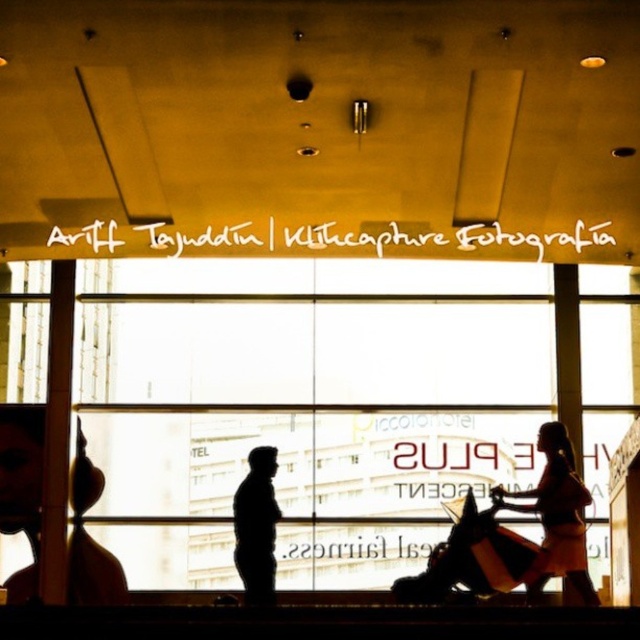
Who is positioned more to the right, matte black baby carriage at lower center or black matte figure at center?

From the viewer's perspective, matte black baby carriage at lower center appears more on the right side.

How much distance is there between matte black baby carriage at lower center and black matte figure at center?

A distance of 10.12 meters exists between matte black baby carriage at lower center and black matte figure at center.

The image size is (640, 640). I want to click on matte black baby carriage at lower center, so click(x=470, y=557).

Who is more forward, [541,497] or [250,513]?

Point [250,513] is more forward.

Consider the image. Is silhouette dress at center wider than black matte figure at center?

Yes.

Is point (541, 506) farther from camera compared to point (250, 460)?

Yes.

At what (x,y) coordinates should I click in order to perform the action: click on silhouette dress at center. Please return your answer as a coordinate pair (x, y). The height and width of the screenshot is (640, 640). Looking at the image, I should click on point(556,516).

Does matte black baby carriage at lower center lie behind silhouette dress at center?

Yes, matte black baby carriage at lower center is behind silhouette dress at center.

Find the location of a particular element. This screenshot has width=640, height=640. matte black baby carriage at lower center is located at coordinates (470, 557).